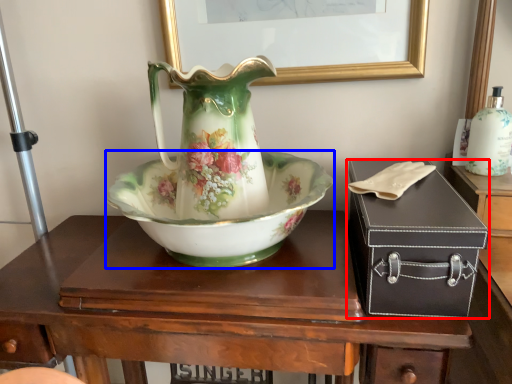
Question: Which object is further to the camera taking this photo, box (highlighted by a red box) or bowl (highlighted by a blue box)?

Choices:
 (A) box
 (B) bowl

Answer: (B)